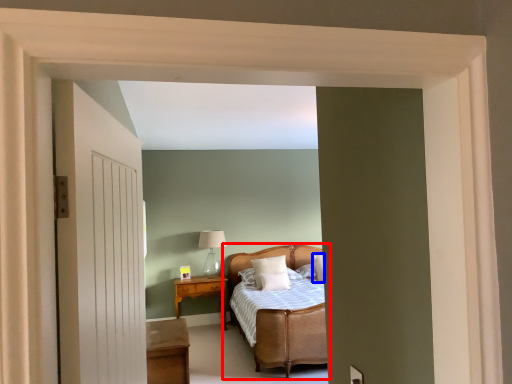
Question: Which of the following is the closest to the observer, bed (highlighted by a red box) or pillow (highlighted by a blue box)?

Choices:
 (A) bed
 (B) pillow

Answer: (A)